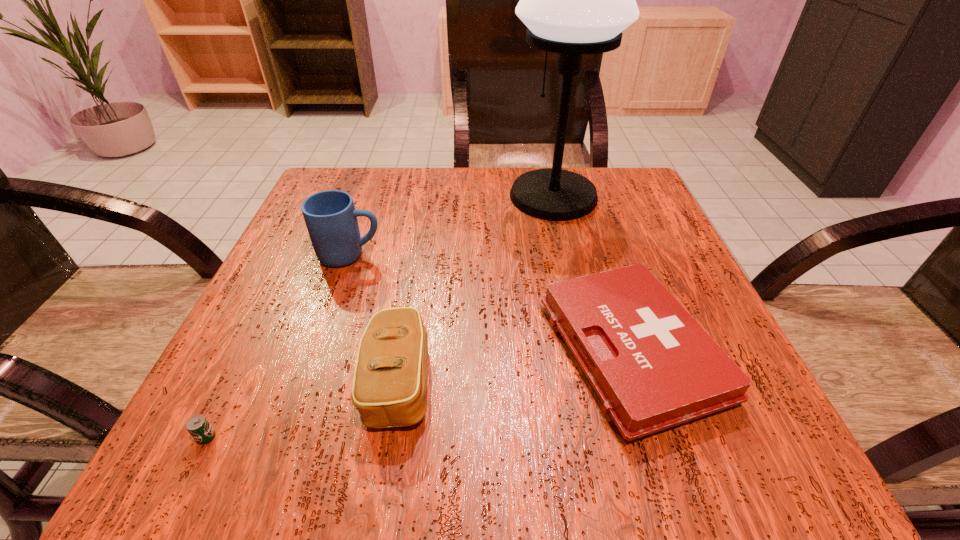
Identify the location of vacant space located on the side of the mug with the handle. (476, 255).

Where is `vacant point located on the zipper side of the third shortest object`? vacant point located on the zipper side of the third shortest object is located at coordinates (681, 381).

Locate an element on the screen. The image size is (960, 540). free region located 0.300m on the back of the second shortest object is located at coordinates (581, 194).

In order to click on blank area located 0.200m on the back of the leftmost object in this screenshot , I will do `click(271, 306)`.

Where is `object that is at the far edge`? object that is at the far edge is located at coordinates (575, 0).

Find the location of a particular element. clutch bag positioned at the near edge is located at coordinates (389, 389).

Find the location of `the first-aid kit present at the near edge`. the first-aid kit present at the near edge is located at coordinates (652, 366).

Find the location of a particular element. The height and width of the screenshot is (540, 960). beer can positioned at the near edge is located at coordinates (198, 426).

Identify the location of mug present at the left edge. The image size is (960, 540). (331, 219).

The height and width of the screenshot is (540, 960). Identify the location of beer can located in the left edge section of the desktop. (198, 426).